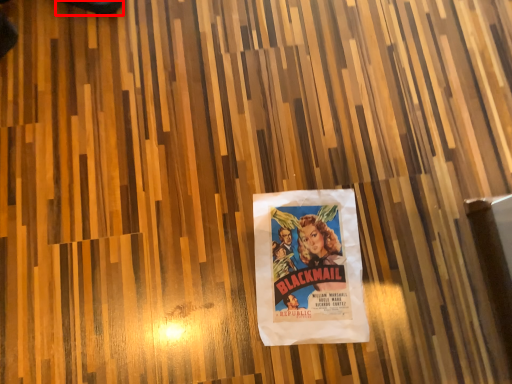
Question: Considering the relative positions of shoe (annotated by the red box) and poster in the image provided, where is shoe (annotated by the red box) located with respect to the staircase?

Choices:
 (A) right
 (B) left

Answer: (B)